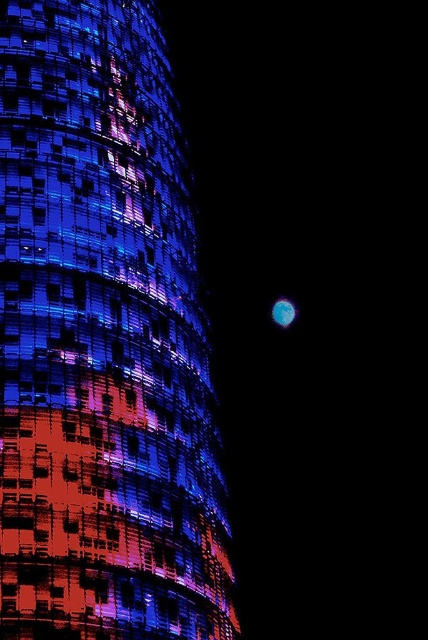
Question: Is shiny glass tower at center wider than blue translucent sphere at right?

Choices:
 (A) no
 (B) yes

Answer: (B)

Question: Does shiny glass tower at center have a smaller size compared to blue translucent sphere at right?

Choices:
 (A) no
 (B) yes

Answer: (A)

Question: Does shiny glass tower at center come behind blue translucent sphere at right?

Choices:
 (A) no
 (B) yes

Answer: (A)

Question: Which of the following is the closest to the observer?

Choices:
 (A) (278, 320)
 (B) (142, 317)

Answer: (B)

Question: Which point appears farthest from the camera in this image?

Choices:
 (A) (291, 301)
 (B) (143, 392)

Answer: (A)